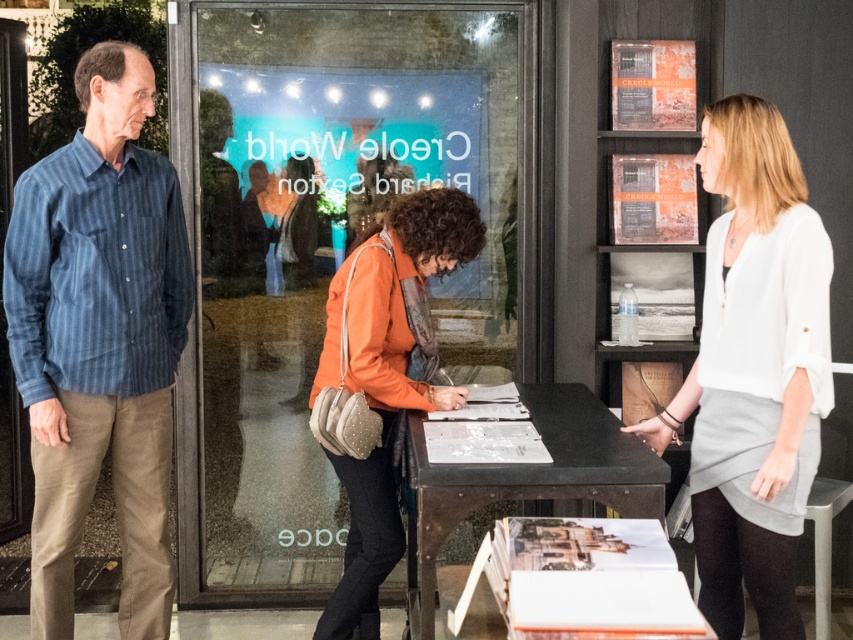
You are a photographer trying to capture both the blue striped shirt at left and the white matte blouse at center in a single shot. Which one will appear larger in the photo?

The blue striped shirt at left appears larger in the photo because it is positioned over the white matte blouse at center, making it closer to the camera.

Consider the image. You are an event planner trying to set up a name tag on the table. The name tag needs to be placed exactly at the position where the white matte blouse at center is located. Can you confirm the coordinates where you should place the name tag?

The white matte blouse at center is located at point (753, 371), so you should place the name tag at those coordinates.

You are an interior designer observing the gallery layout. You need to determine if the blue striped shirt at left can be placed on the black metal table at center without falling off. Based on their dimensions, is this possible?

The blue striped shirt at left is thinner than the black metal table at center, so it can be placed on the table without falling off since its width is narrower than the table.